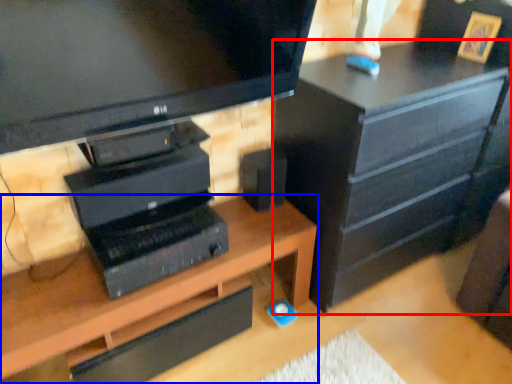
Question: Among these objects, which one is nearest to the camera, chest of drawers (highlighted by a red box) or desk (highlighted by a blue box)?

Choices:
 (A) chest of drawers
 (B) desk

Answer: (B)